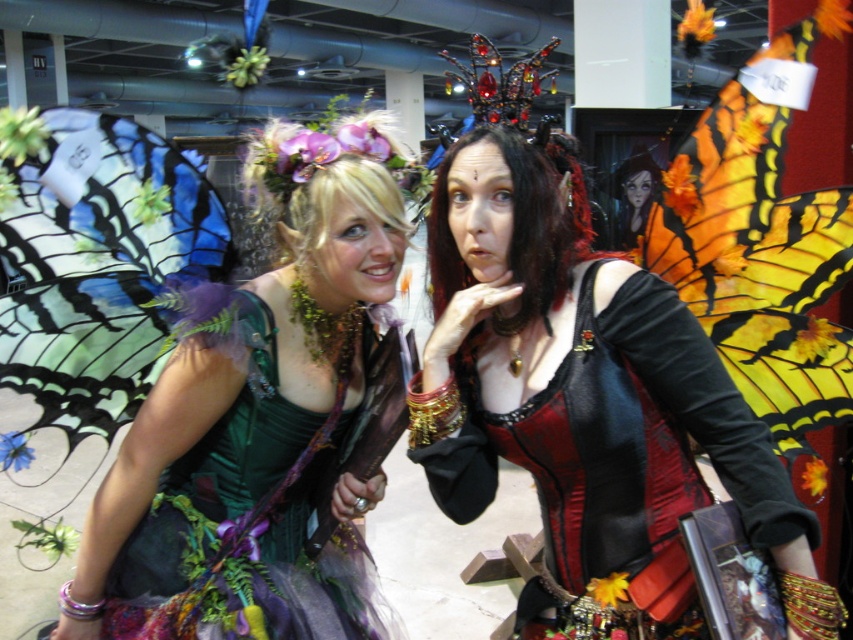
Is matte black corset at center bigger than translucent blue fabric butterfly at left?

Yes, matte black corset at center is bigger than translucent blue fabric butterfly at left.

Is point (614, 420) positioned after point (207, 209)?

No, it is not.

In order to click on matte black corset at center in this screenshot , I will do `click(585, 403)`.

Locate an element on the screen. The image size is (853, 640). matte black corset at center is located at coordinates (585, 403).

Is green velvet dress at left taller than translucent blue fabric butterfly at left?

Yes.

Is green velvet dress at left bigger than translucent blue fabric butterfly at left?

Correct, green velvet dress at left is larger in size than translucent blue fabric butterfly at left.

Find the location of `green velvet dress at left`. green velvet dress at left is located at coordinates (257, 420).

This screenshot has height=640, width=853. In order to click on green velvet dress at left in this screenshot , I will do `click(257, 420)`.

Does matte black corset at center appear over green velvet dress at left?

Yes.

Is the position of matte black corset at center more distant than that of green velvet dress at left?

No, matte black corset at center is in front of green velvet dress at left.

Measure the distance between matte black corset at center and camera.

1.15 meters

You are a GUI agent. You are given a task and a screenshot of the screen. Output one action in this format:
    pyautogui.click(x=<x>, y=<y>)
    Task: Click on the matte black corset at center
    The height and width of the screenshot is (640, 853).
    Given the screenshot: What is the action you would take?
    pyautogui.click(x=585, y=403)